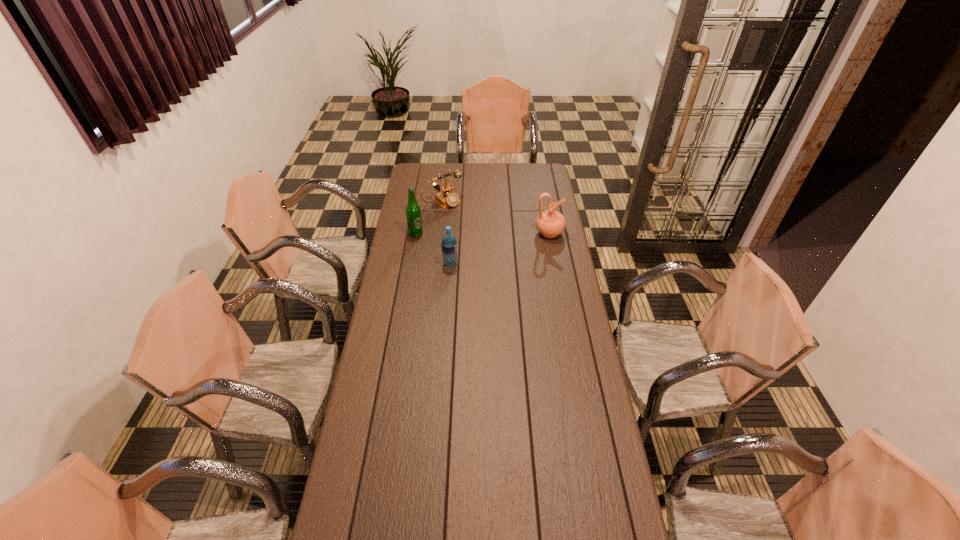
The width and height of the screenshot is (960, 540). In the image, there is a desktop. What are the coordinates of `blank space at the far right corner` in the screenshot? It's located at (540, 179).

Find the location of a particular element. The width and height of the screenshot is (960, 540). empty location between the shortest object and the water bottle is located at coordinates (446, 233).

Where is `free space that is in between the farthest object and the beer bottle`? free space that is in between the farthest object and the beer bottle is located at coordinates pos(429,218).

Image resolution: width=960 pixels, height=540 pixels. Identify the location of free point between the rightmost object and the beer bottle. (483, 233).

Find the location of `free area in between the nearest object and the pottery`. free area in between the nearest object and the pottery is located at coordinates (500, 248).

Identify the location of free space between the nearest object and the pottery. The image size is (960, 540). (500, 248).

The height and width of the screenshot is (540, 960). I want to click on vacant area between the pottery and the nearest object, so click(x=500, y=248).

Identify the location of unoccupied position between the pottery and the farthest object. (496, 218).

At what (x,y) coordinates should I click in order to perform the action: click on free space between the beer bottle and the shortest object. Please return your answer as a coordinate pair (x, y). Image resolution: width=960 pixels, height=540 pixels. Looking at the image, I should click on (429, 218).

What are the coordinates of `vacant point located between the rightmost object and the telephone` in the screenshot? It's located at (496, 218).